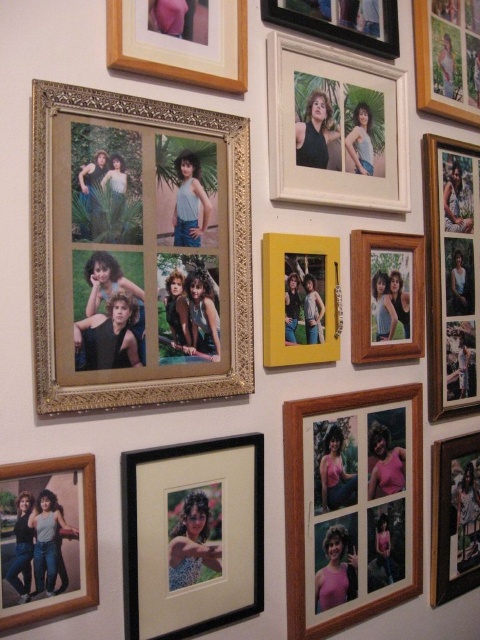
Can you confirm if gold ornate frame at upper left is wider than wooden photo frame at center-right?

Yes.

Image resolution: width=480 pixels, height=640 pixels. What do you see at coordinates (137, 250) in the screenshot? I see `gold ornate frame at upper left` at bounding box center [137, 250].

Does point (81, 388) lie in front of point (410, 289)?

Yes, point (81, 388) is closer to viewer.

The width and height of the screenshot is (480, 640). I want to click on gold ornate frame at upper left, so click(x=137, y=250).

Which is behind, point (302, 115) or point (446, 458)?

The point (446, 458) is more distant.

Can you confirm if white wood photo frame at upper center is wider than matte black photo frame at lower right?

Indeed, white wood photo frame at upper center has a greater width compared to matte black photo frame at lower right.

Which is behind, point (379, 170) or point (477, 515)?

Point (477, 515)

The height and width of the screenshot is (640, 480). What are the coordinates of `white wood photo frame at upper center` in the screenshot? It's located at (336, 128).

Looking at this image, who is shorter, matte wood photo frame at lower left or wooden photo frame at center-right?

With less height is matte wood photo frame at lower left.

Based on the photo, between matte wood photo frame at lower left and wooden photo frame at center-right, which one has more height?

wooden photo frame at center-right

The width and height of the screenshot is (480, 640). Identify the location of matte wood photo frame at lower left. (47, 540).